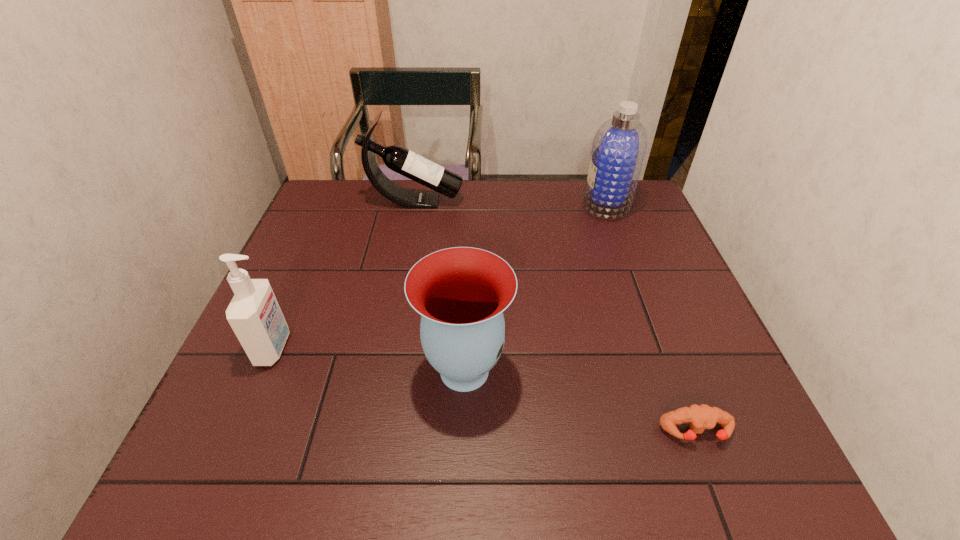
The width and height of the screenshot is (960, 540). What are the coordinates of `vacant space at the far edge of the desktop` in the screenshot? It's located at (534, 212).

Find the location of a particular element. The width and height of the screenshot is (960, 540). free space at the near edge is located at coordinates (465, 476).

This screenshot has height=540, width=960. In order to click on vacant region at the left edge of the desktop in this screenshot , I will do `click(283, 303)`.

In the image, there is a desktop. What are the coordinates of `vacant region at the far right corner` in the screenshot? It's located at (632, 205).

Find the location of a particular element. This screenshot has width=960, height=540. free space at the near right corner is located at coordinates (x=704, y=440).

Identify the location of empty space that is in between the right cleansing agent and the vase. (536, 287).

Find the location of a particular element. unoccupied area between the wine bottle and the farther cleansing agent is located at coordinates (511, 202).

I want to click on empty space between the puncher and the leftmost object, so (x=485, y=390).

Where is `free space between the farther cleansing agent and the vase`? The image size is (960, 540). free space between the farther cleansing agent and the vase is located at coordinates (536, 287).

Image resolution: width=960 pixels, height=540 pixels. Identify the location of free space between the shorter cleansing agent and the wine bottle. (345, 275).